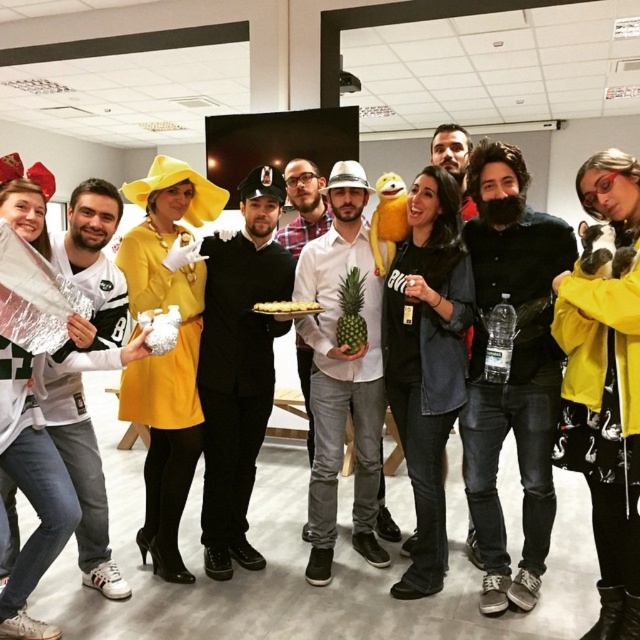
Does white matte pineapple at center have a larger size compared to white jersey at left?

Correct, white matte pineapple at center is larger in size than white jersey at left.

Between point (314, 410) and point (74, 484), which one is positioned in front?

Point (74, 484) is in front.

Which is in front, point (328, 566) or point (64, 417)?

Point (64, 417) is more forward.

Identify the location of white matte pineapple at center. The width and height of the screenshot is (640, 640). (340, 376).

Between white jersey at left and matte black suit at center, which one has more height?

white jersey at left is taller.

Is white jersey at left shorter than matte black suit at center?

No.

Who is more distant from viewer, (65, 396) or (304, 352)?

The point (304, 352) is more distant.

Image resolution: width=640 pixels, height=640 pixels. In order to click on white jersey at left in this screenshot , I will do `click(81, 476)`.

The width and height of the screenshot is (640, 640). What do you see at coordinates (237, 365) in the screenshot? I see `matte black uniform at center` at bounding box center [237, 365].

Identify the location of matte black uniform at center. Image resolution: width=640 pixels, height=640 pixels. (237, 365).

The height and width of the screenshot is (640, 640). Find the location of `matte black uniform at center`. matte black uniform at center is located at coordinates (237, 365).